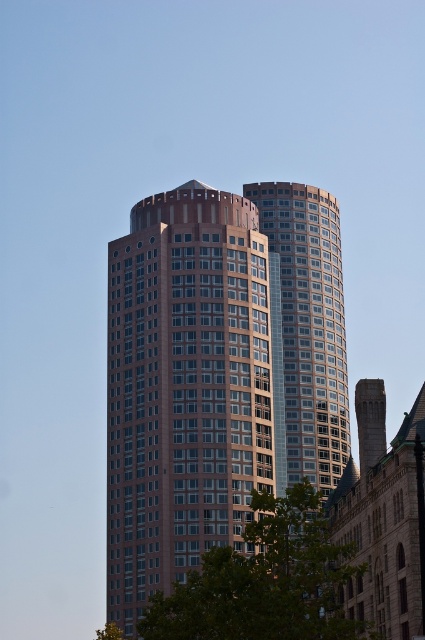
Does green leafy tree at lower center appear over green leafy tree at lower left?

Yes.

In the scene shown: Who is higher up, green leafy tree at lower center or green leafy tree at lower left?

green leafy tree at lower center is higher up.

The image size is (425, 640). Find the location of `green leafy tree at lower center`. green leafy tree at lower center is located at coordinates pos(265,580).

Can you confirm if pink glassy building at center is wider than shiny glass building at right?

Yes.

Between pink glassy building at center and shiny glass building at right, which one has less height?

shiny glass building at right

At what (x,y) coordinates should I click in order to perform the action: click on pink glassy building at center. Please return your answer as a coordinate pair (x, y). Looking at the image, I should click on (217, 372).

Is pink glassy building at center bigger than green leafy tree at lower left?

Indeed, pink glassy building at center has a larger size compared to green leafy tree at lower left.

Identify the location of pink glassy building at center. The image size is (425, 640). (217, 372).